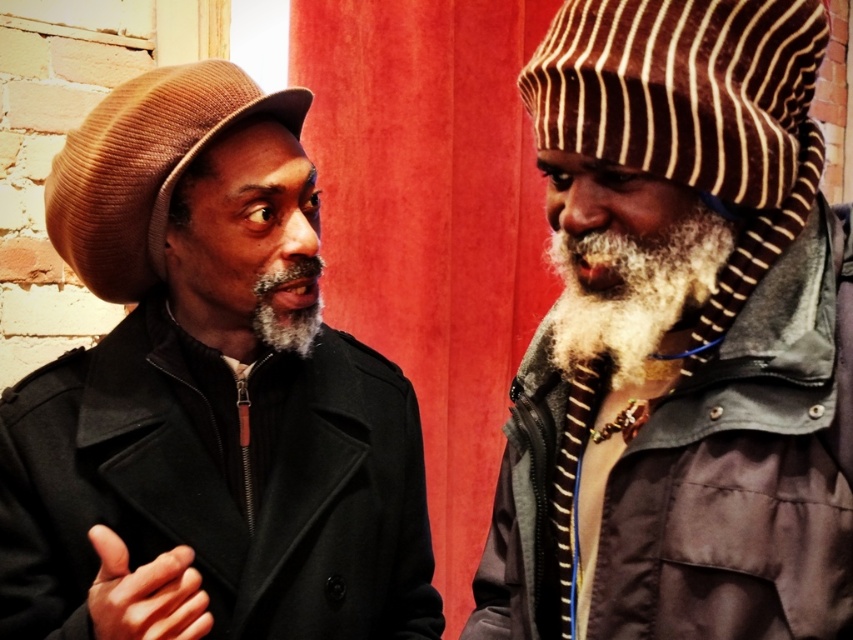
Looking at this image, who is shorter, striped knit hat at right or white fuzzy beard at center?

With less height is white fuzzy beard at center.

Does striped knit hat at right have a larger size compared to white fuzzy beard at center?

Yes.

Is point (729, 346) positioned behind point (628, 243)?

Yes.

I want to click on striped knit hat at right, so click(679, 339).

Which is in front, point (173, 570) or point (54, 173)?

Positioned in front is point (173, 570).

Between point (198, 244) and point (225, 80), which one is positioned behind?

Point (225, 80)

Identify the location of matte brown hat at left. (206, 400).

In the scene shown: Is brown corduroy hat at left below white fuzzy beard at center?

Incorrect, brown corduroy hat at left is not positioned below white fuzzy beard at center.

The width and height of the screenshot is (853, 640). Find the location of `brown corduroy hat at left`. brown corduroy hat at left is located at coordinates (144, 168).

Is point (236, 106) less distant than point (618, 388)?

No, it is behind (618, 388).

Where is `brown corduroy hat at left`? The image size is (853, 640). brown corduroy hat at left is located at coordinates (144, 168).